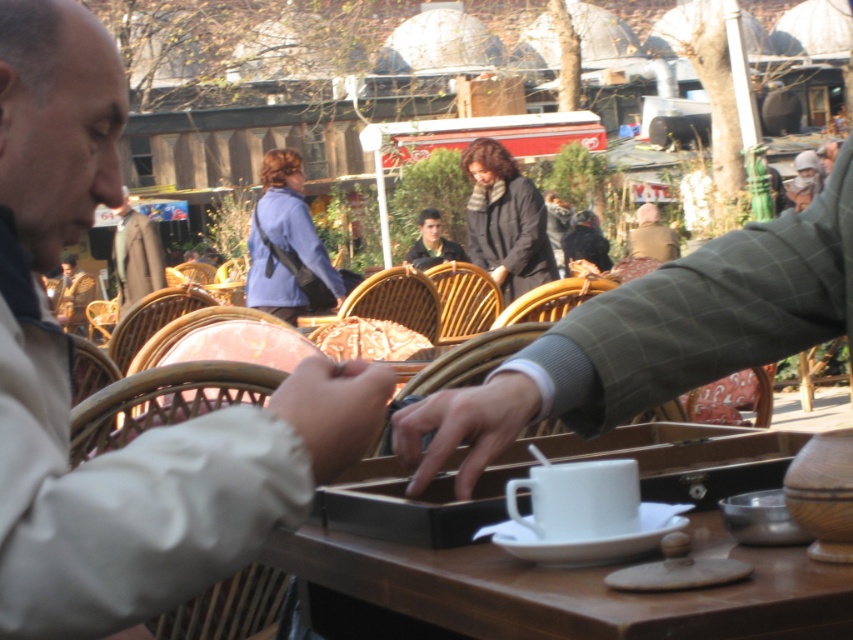
Question: Among these objects, which one is farthest from the camera?

Choices:
 (A) green plaid jacket at center
 (B) brown wooden table at center
 (C) light beige jacket at upper left
 (D) white ceramic saucer at lower center

Answer: (A)

Question: Among these points, which one is farthest from the camera?

Choices:
 (A) (416, 252)
 (B) (22, 374)

Answer: (A)

Question: Among these points, which one is farthest from the camera?

Choices:
 (A) (524, 557)
 (B) (158, 243)

Answer: (B)

Question: In this image, where is golden textured bread at center located relative to matte black jacket at center?

Choices:
 (A) left
 (B) right

Answer: (A)

Question: Is smooth leather hand at center thinner than light brown leather jacket at center?

Choices:
 (A) yes
 (B) no

Answer: (A)

Question: Considering the relative positions of smooth leather hand at center and fuzzy beige hand at center in the image provided, where is smooth leather hand at center located with respect to fuzzy beige hand at center?

Choices:
 (A) right
 (B) left

Answer: (A)